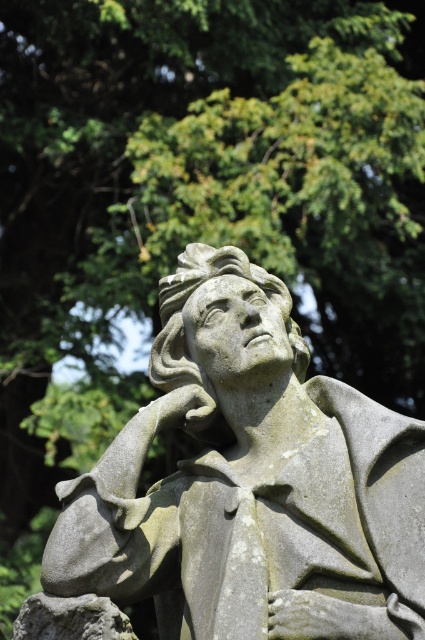
Question: Is gray stone statue at center smaller than gray stone statue at lower left?

Choices:
 (A) yes
 (B) no

Answer: (B)

Question: Which point is closer to the camera?

Choices:
 (A) gray stone statue at center
 (B) gray stone statue at lower left

Answer: (A)

Question: Which point is closer to the camera taking this photo?

Choices:
 (A) (240, 618)
 (B) (82, 600)

Answer: (A)

Question: Does gray stone statue at center come behind gray stone statue at lower left?

Choices:
 (A) no
 (B) yes

Answer: (A)

Question: Is gray stone statue at center below gray stone statue at lower left?

Choices:
 (A) yes
 (B) no

Answer: (B)